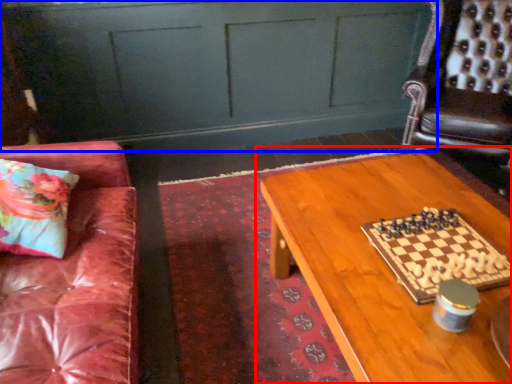
Question: Among these objects, which one is nearest to the camera, table (highlighted by a red box) or dresser (highlighted by a blue box)?

Choices:
 (A) table
 (B) dresser

Answer: (A)